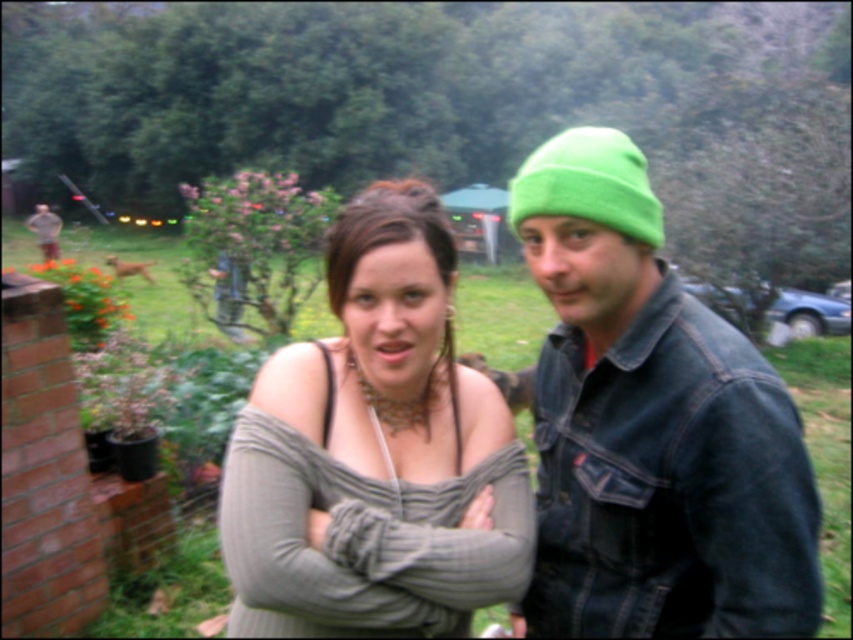
Question: Which is farther from the matte gray sweater at center?

Choices:
 (A) green fleece beanie at upper right
 (B) green knit beanie at upper right

Answer: (A)

Question: Does matte gray sweater at center appear over green fleece beanie at upper right?

Choices:
 (A) no
 (B) yes

Answer: (A)

Question: Is green knit beanie at upper right above matte gray sweater at center?

Choices:
 (A) no
 (B) yes

Answer: (B)

Question: Is the position of matte gray sweater at center less distant than that of green fleece beanie at upper right?

Choices:
 (A) no
 (B) yes

Answer: (B)

Question: Among these points, which one is farthest from the camera?

Choices:
 (A) (556, 179)
 (B) (500, 419)

Answer: (B)

Question: Which object appears closest to the camera in this image?

Choices:
 (A) matte gray sweater at center
 (B) green fleece beanie at upper right
 (C) green knit beanie at upper right

Answer: (C)